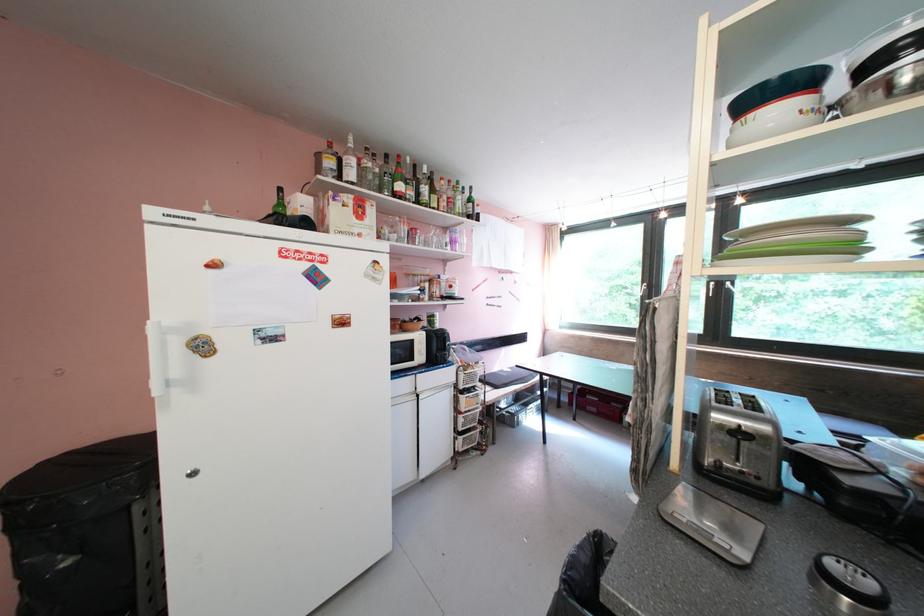
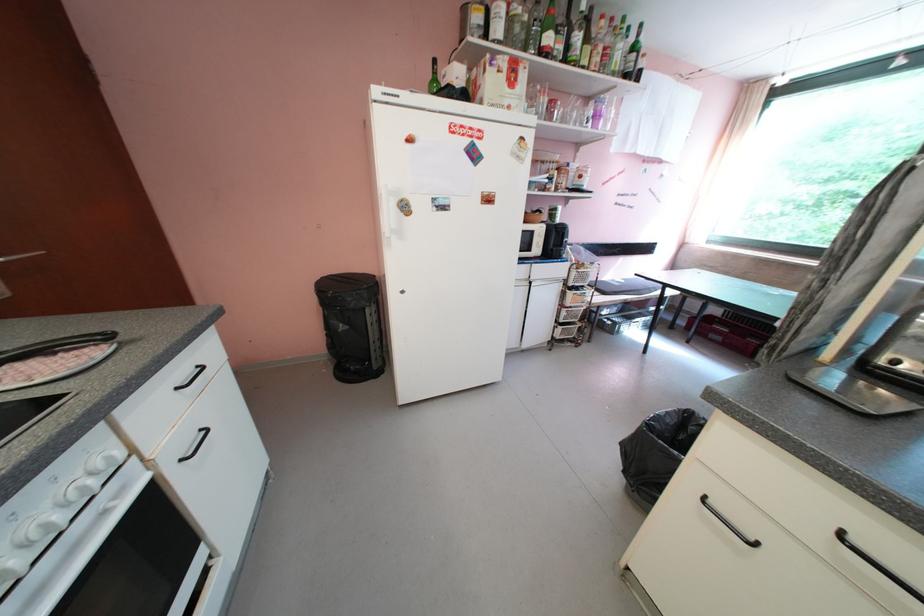
Locate, in the second image, the point that corresponds to [407,221] in the first image.

(546, 90)